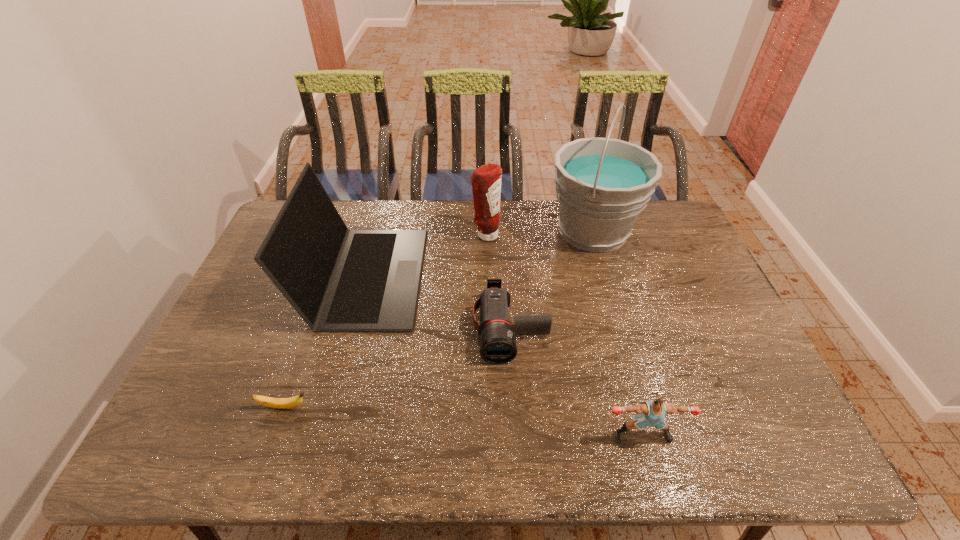
Find the location of a particular element. vacant space at the near edge of the desktop is located at coordinates (474, 434).

Locate an element on the screen. free space at the left edge of the desktop is located at coordinates (204, 386).

Identify the location of vacant space at the right edge of the desktop. (689, 314).

Where is `free space at the far right corner of the desktop`? The height and width of the screenshot is (540, 960). free space at the far right corner of the desktop is located at coordinates (677, 232).

Locate an element on the screen. empty location between the banana and the nearest object is located at coordinates pyautogui.click(x=464, y=421).

I want to click on free spot between the camcorder and the bucket, so click(x=551, y=280).

The height and width of the screenshot is (540, 960). I want to click on free space between the nearest object and the second shortest object, so click(x=577, y=382).

Where is `free space that is in between the bucket and the second shortest object`? The image size is (960, 540). free space that is in between the bucket and the second shortest object is located at coordinates (551, 280).

What are the coordinates of `empty space between the laptop and the tallest object` in the screenshot? It's located at (479, 253).

Image resolution: width=960 pixels, height=540 pixels. Find the location of `empty space between the camcorder and the laptop`. empty space between the camcorder and the laptop is located at coordinates (438, 302).